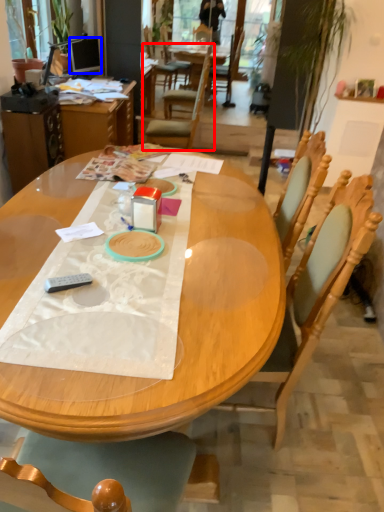
Question: Which object is closer to the camera taking this photo, chair (highlighted by a red box) or television (highlighted by a blue box)?

Choices:
 (A) chair
 (B) television

Answer: (A)